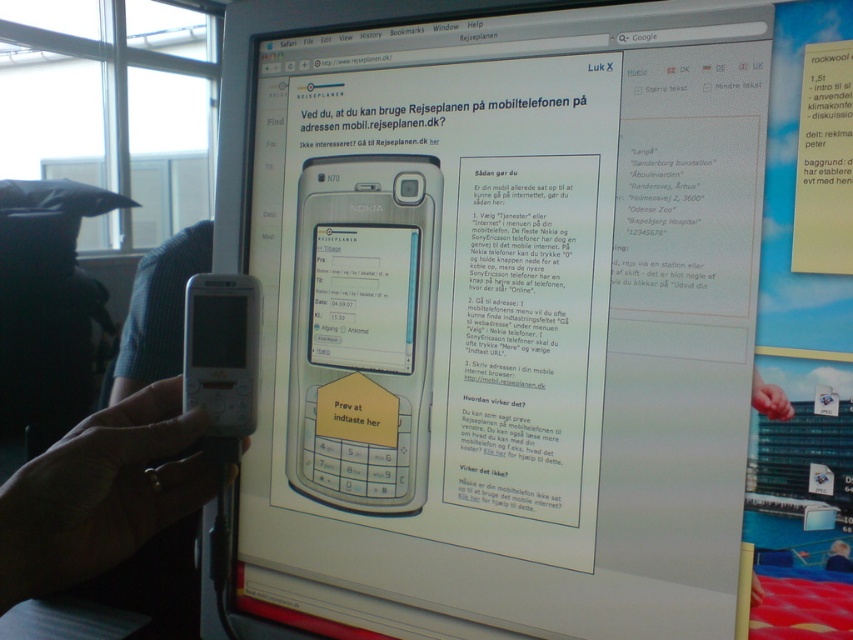
Is silver metallic phone at center closer to the viewer compared to yellow paper note at upper right?

No, it is behind yellow paper note at upper right.

Is silver metallic phone at center shorter than yellow paper note at upper right?

No.

Where is `silver metallic phone at center`? The image size is (853, 640). silver metallic phone at center is located at coordinates (491, 314).

Which is in front, point (343, 380) or point (755, 378)?

Point (755, 378)

Is matte black phone at center further to camera compared to skinny white hand at lower right?

Yes, matte black phone at center is behind skinny white hand at lower right.

This screenshot has width=853, height=640. I want to click on matte black phone at center, so click(x=363, y=330).

Where is `matte black phone at center`? matte black phone at center is located at coordinates (363, 330).

Is yellow paper note at upper right closer to the viewer compared to skinny white hand at lower right?

Yes.

Consider the image. Can you confirm if yellow paper note at upper right is positioned to the left of skinny white hand at lower right?

Incorrect, yellow paper note at upper right is not on the left side of skinny white hand at lower right.

Who is more forward, (842,472) or (769,413)?

Point (842,472) is more forward.

Where is `yellow paper note at upper right`? This screenshot has width=853, height=640. yellow paper note at upper right is located at coordinates coord(805,333).